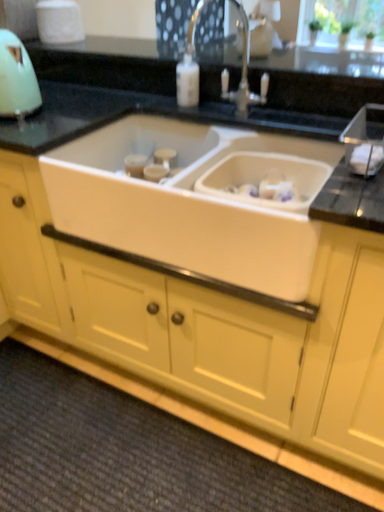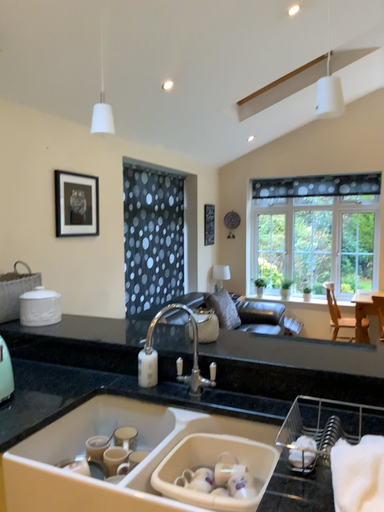
Question: How did the camera likely rotate when shooting the video?

Choices:
 (A) rotated downward
 (B) rotated upward

Answer: (B)